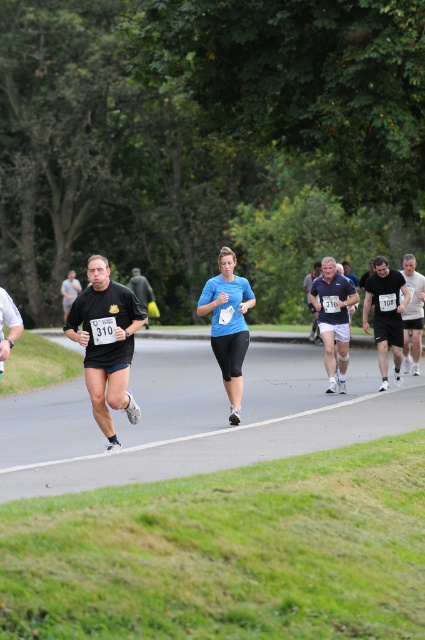
From the picture: You are a participant in the marathon wearing a blue matte running top at center. You want to check your current position relative to the point marked at coordinates (227, 324). Is this point located on your clothing?

Yes, the point marked at coordinates (227, 324) is located on your blue matte running top at center, so it is on your clothing.

You are a photographer positioned at the starting line of the marathon. You want to take a photo of the blue matte running top at center and the blue fabric shorts at center. Which one will appear larger in your photo?

The blue matte running top at center will appear larger in the photo because it is closer to the viewer than the blue fabric shorts at center.